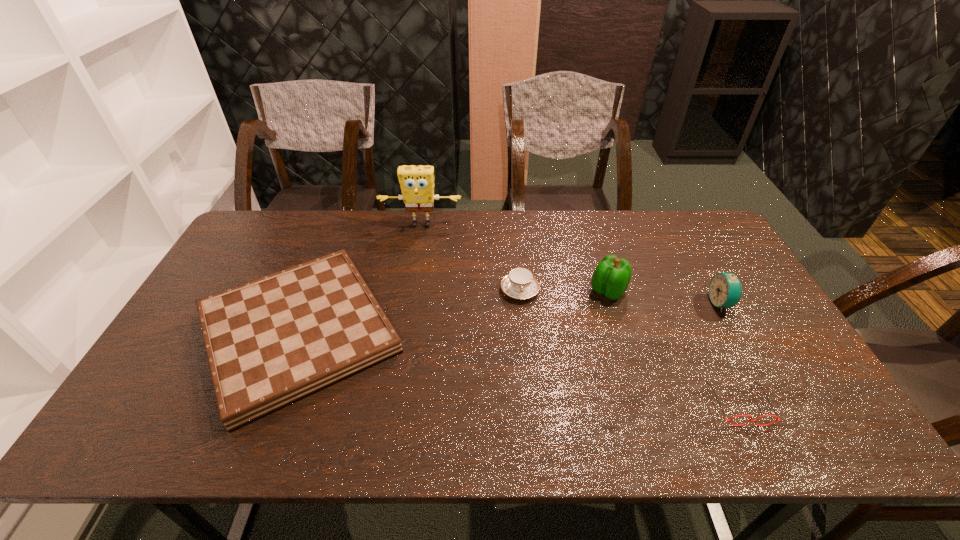
Locate an element on the screen. vacant area that lies between the teacup and the sponge is located at coordinates (470, 258).

This screenshot has width=960, height=540. I want to click on empty space between the fourth object from right to left and the sponge, so click(470, 258).

This screenshot has width=960, height=540. Find the location of `free space that is in between the shortest object and the fourth object from left to right`. free space that is in between the shortest object and the fourth object from left to right is located at coordinates (673, 347).

Where is `free space between the alarm clock and the spectacles`? This screenshot has width=960, height=540. free space between the alarm clock and the spectacles is located at coordinates (730, 354).

Locate an element on the screen. free space between the bell pepper and the gameboard is located at coordinates (453, 312).

The width and height of the screenshot is (960, 540). I want to click on blank region between the gameboard and the spectacles, so click(518, 368).

Locate an element on the screen. free space between the teacup and the spectacles is located at coordinates (629, 347).

Locate an element on the screen. This screenshot has width=960, height=540. object that is the third closest to the third object from right to left is located at coordinates (755, 421).

Locate which object is the fourth closest to the gameboard. Please provide its 2D coordinates. Your answer should be formatted as a tuple, i.e. [(x, y)], where the tuple contains the x and y coordinates of a point satisfying the conditions above.

[(755, 421)]

You are a GUI agent. You are given a task and a screenshot of the screen. Output one action in this format:
    pyautogui.click(x=<x>, y=<y>)
    Task: Click on the blank area in the image that satisfies the following two spatial constraints: 1. on the face of the tallest object; 2. on the left side of the bell pepper
    
    Given the screenshot: What is the action you would take?
    pyautogui.click(x=410, y=291)